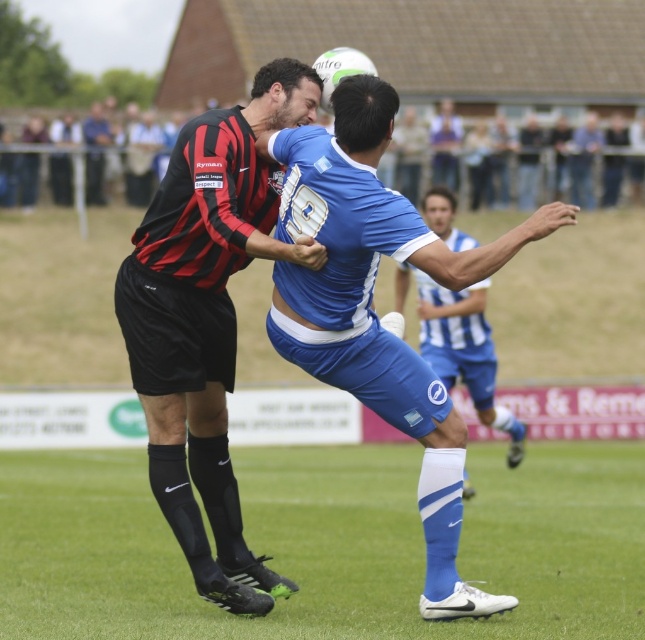
Is green grass at center bigger than blue jersey at center?

Correct, green grass at center is larger in size than blue jersey at center.

Is point (617, 492) positioned in front of point (497, 404)?

Yes, it is in front of point (497, 404).

What are the coordinates of `green grass at center` in the screenshot? It's located at (326, 544).

Does black matte jersey at center have a larger size compared to blue matte jersey at center?

Incorrect, black matte jersey at center is not larger than blue matte jersey at center.

Does black matte jersey at center lie behind blue matte jersey at center?

That is True.

Which is in front, point (270, 182) or point (382, 369)?

Point (382, 369)

Where is `black matte jersey at center`? The image size is (645, 640). black matte jersey at center is located at coordinates (206, 320).

Can you confirm if black matte jersey at center is positioned above blue jersey at center?

No.

Does black matte jersey at center come behind blue jersey at center?

No, black matte jersey at center is in front of blue jersey at center.

This screenshot has width=645, height=640. What do you see at coordinates (206, 320) in the screenshot? I see `black matte jersey at center` at bounding box center [206, 320].

Find the location of `black matte jersey at center`. black matte jersey at center is located at coordinates (206, 320).